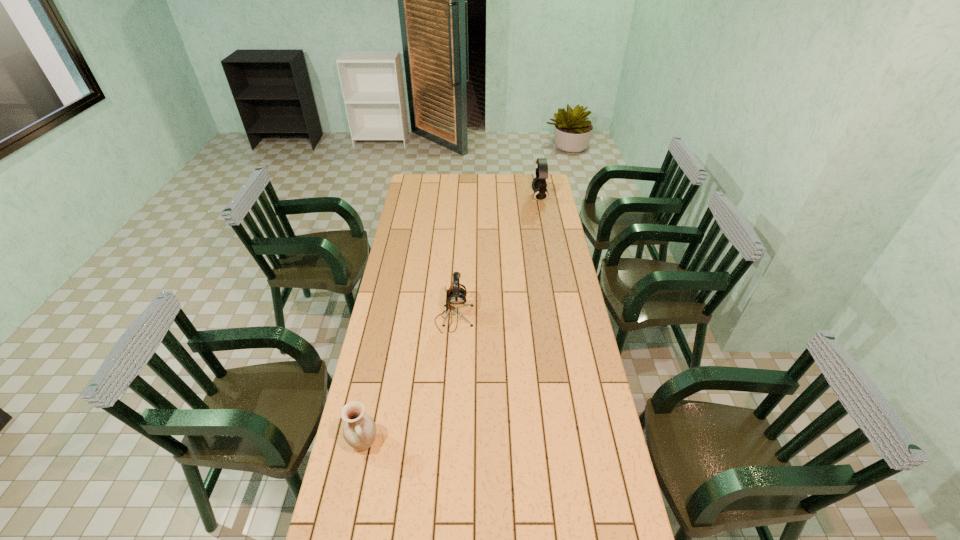
Locate an element on the screen. The width and height of the screenshot is (960, 540). vacant area that lies between the nearest object and the second object from left to right is located at coordinates (409, 381).

Find the location of a particular element. The width and height of the screenshot is (960, 540). blank region between the nearest object and the left earphone is located at coordinates (409, 381).

This screenshot has width=960, height=540. Identify the location of free point between the right earphone and the nearer earphone. (496, 258).

At what (x,y) coordinates should I click in order to perform the action: click on unoccupied position between the left earphone and the leftmost object. Please return your answer as a coordinate pair (x, y). Looking at the image, I should click on (409, 381).

The image size is (960, 540). I want to click on empty location between the rightmost object and the nearer earphone, so click(496, 258).

You are a GUI agent. You are given a task and a screenshot of the screen. Output one action in this format:
    pyautogui.click(x=<x>, y=<y>)
    Task: Click on the object that ranks as the closest to the second object from left to right
    
    Given the screenshot: What is the action you would take?
    pyautogui.click(x=359, y=431)

Select which object appears as the second closest to the farther earphone. Please provide its 2D coordinates. Your answer should be formatted as a tuple, i.e. [(x, y)], where the tuple contains the x and y coordinates of a point satisfying the conditions above.

[(359, 431)]

Locate an element on the screen. This screenshot has height=540, width=960. free spot that satisfies the following two spatial constraints: 1. on the ear cups of the farther earphone; 2. on the front side of the shortest object is located at coordinates (586, 442).

Locate an element on the screen. The height and width of the screenshot is (540, 960). free spot that satisfies the following two spatial constraints: 1. on the ear cups of the rightmost object; 2. on the front side of the nearer earphone is located at coordinates (562, 319).